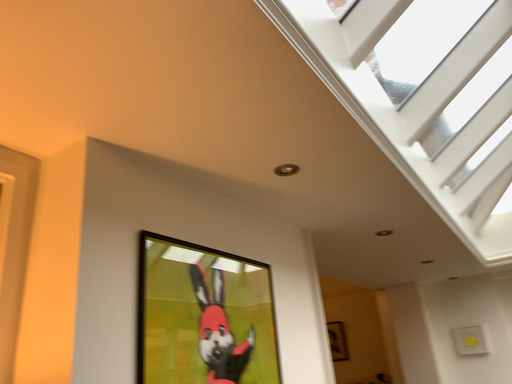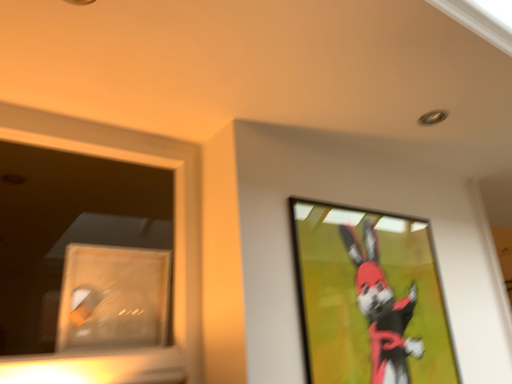
Question: How did the camera likely rotate when shooting the video?

Choices:
 (A) rotated left
 (B) rotated right

Answer: (A)